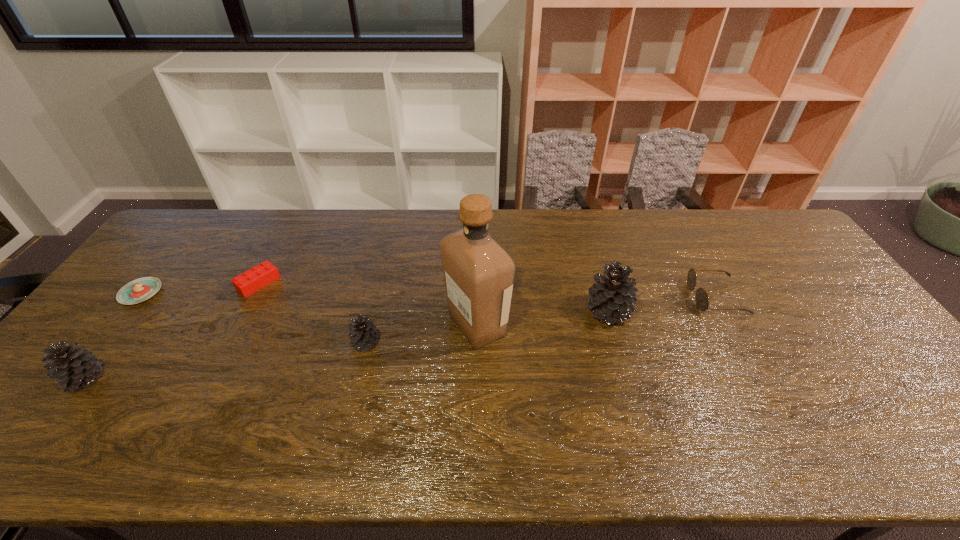
Where is `the rightmost object`? The image size is (960, 540). the rightmost object is located at coordinates (701, 298).

Identify the location of sunglasses. The width and height of the screenshot is (960, 540). (701, 298).

Identify the location of the shortest object. The image size is (960, 540). (139, 290).

Locate an element on the screen. The height and width of the screenshot is (540, 960). free region located 0.280m on the back of the second tallest pinecone is located at coordinates (156, 286).

At what (x,y) coordinates should I click in order to perform the action: click on vacant space located 0.130m on the left of the second pinecone from left to right. Please return your answer as a coordinate pair (x, y). Looking at the image, I should click on (300, 343).

Identify the location of vacant space located 0.130m on the back of the farthest pinecone. This screenshot has width=960, height=540. (595, 266).

Identify the location of blank space located on the right of the fifth object from right to left. Image resolution: width=960 pixels, height=540 pixels. (314, 283).

Identify the location of vacant space located 0.090m on the front-facing side of the fifth object from left to right. Image resolution: width=960 pixels, height=540 pixels. (542, 325).

What are the coordinates of `free location located 0.100m on the lenses of the rightmost object` in the screenshot? It's located at (657, 298).

This screenshot has height=540, width=960. What are the coordinates of `blank area located 0.190m on the lenses of the rightmost object` in the screenshot? It's located at coord(626,298).